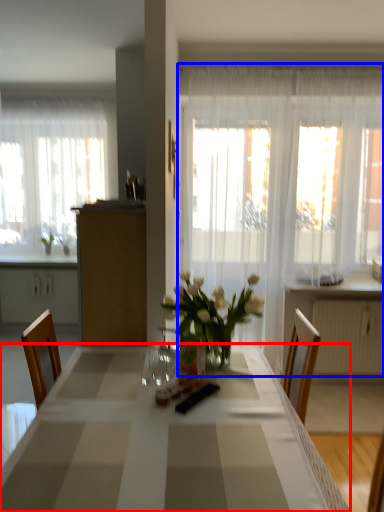
Question: Among these objects, which one is nearest to the camera, desk (highlighted by a red box) or curtain (highlighted by a blue box)?

Choices:
 (A) desk
 (B) curtain

Answer: (A)